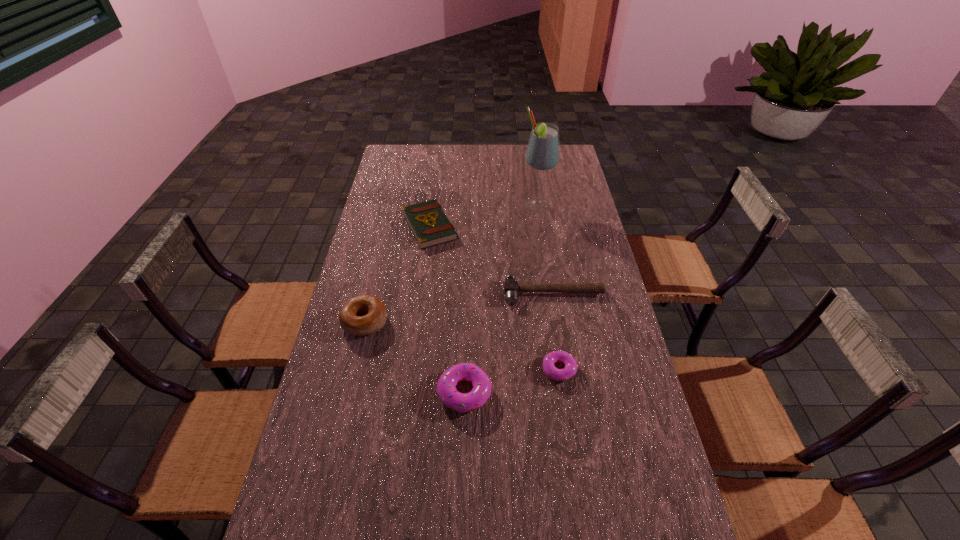
Locate an element on the screen. Image resolution: width=960 pixels, height=540 pixels. blank region between the book and the hammer is located at coordinates (492, 260).

At what (x,y) coordinates should I click in order to perform the action: click on empty location between the book and the hammer. Please return your answer as a coordinate pair (x, y). This screenshot has height=540, width=960. Looking at the image, I should click on (492, 260).

You are a GUI agent. You are given a task and a screenshot of the screen. Output one action in this format:
    pyautogui.click(x=<x>, y=<y>)
    Task: Click on the empty space between the book and the taller doughnut
    This screenshot has width=960, height=540.
    Given the screenshot: What is the action you would take?
    pyautogui.click(x=447, y=309)

Identify which object is the second nearest to the hammer. Please provide its 2D coordinates. Your answer should be formatted as a tuple, i.e. [(x, y)], where the tuple contains the x and y coordinates of a point satisfying the conditions above.

[(428, 222)]

This screenshot has height=540, width=960. Identify the location of object that stands as the fifth closest to the hammer. (361, 315).

Locate an element on the screen. This screenshot has height=540, width=960. vacant point that satisfies the following two spatial constraints: 1. on the front side of the fourth shortest object; 2. on the right side of the bagel is located at coordinates (348, 393).

Locate an element on the screen. This screenshot has height=540, width=960. free region that satisfies the following two spatial constraints: 1. on the back side of the shorter doughnut; 2. on the left side of the alcohol is located at coordinates (535, 205).

Where is `vacant space that satisfies the following two spatial constraints: 1. on the front side of the book; 2. on the right side of the taller doughnut`? Image resolution: width=960 pixels, height=540 pixels. vacant space that satisfies the following two spatial constraints: 1. on the front side of the book; 2. on the right side of the taller doughnut is located at coordinates (408, 393).

Locate an element on the screen. The height and width of the screenshot is (540, 960). vacant space that satisfies the following two spatial constraints: 1. on the back side of the book; 2. on the right side of the tallest object is located at coordinates (432, 205).

The width and height of the screenshot is (960, 540). I want to click on blank space that satisfies the following two spatial constraints: 1. on the back side of the fifth shortest object; 2. on the left side of the tallest object, so click(x=393, y=205).